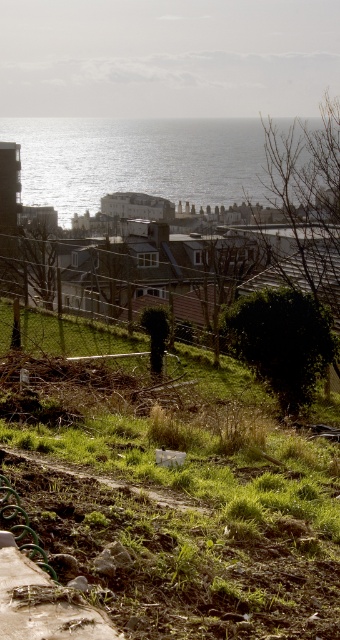
You are standing at the elevated vantage point overlooking the coastal scene. You spot two points marked in the image. Which point, point (x=181, y=468) or point (x=126, y=150), is closer to your current position?

Point (x=181, y=468) is closer to the viewer than point (x=126, y=150).

You are standing on the elevated vantage point and want to determine the relative heights of the green grass at lower center and the glistening silver water at upper center. Which one is shorter?

The green grass at lower center is shorter than the glistening silver water at upper center according to the description.